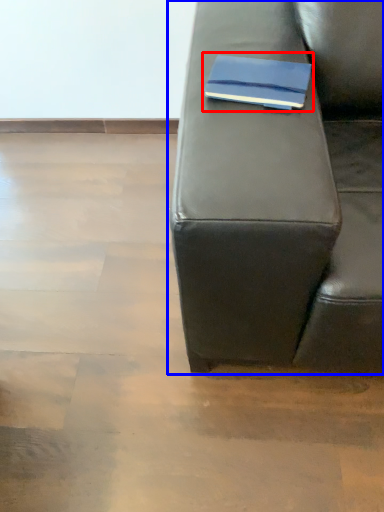
Question: Which of the following is the closest to the observer, paperback book (highlighted by a red box) or studio couch (highlighted by a blue box)?

Choices:
 (A) paperback book
 (B) studio couch

Answer: (B)